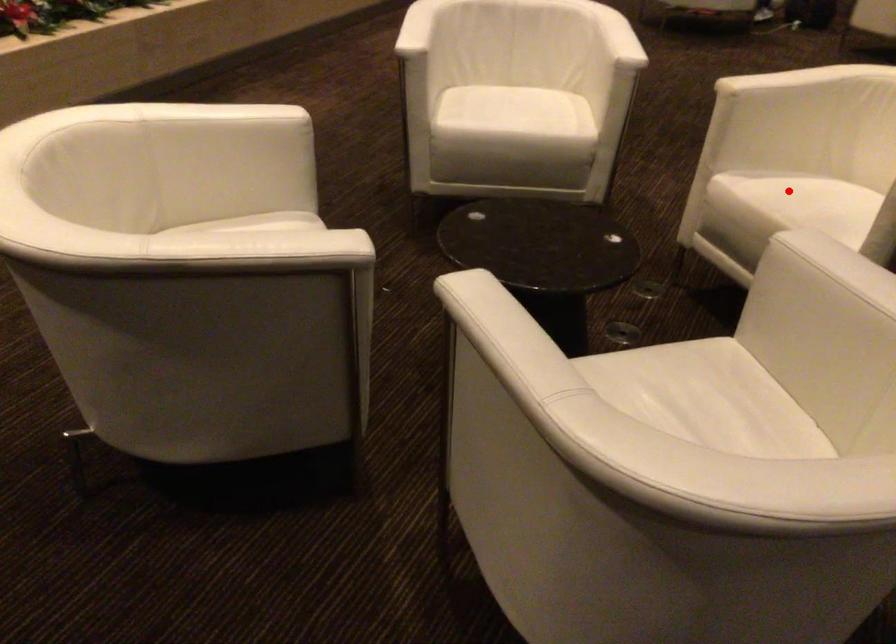
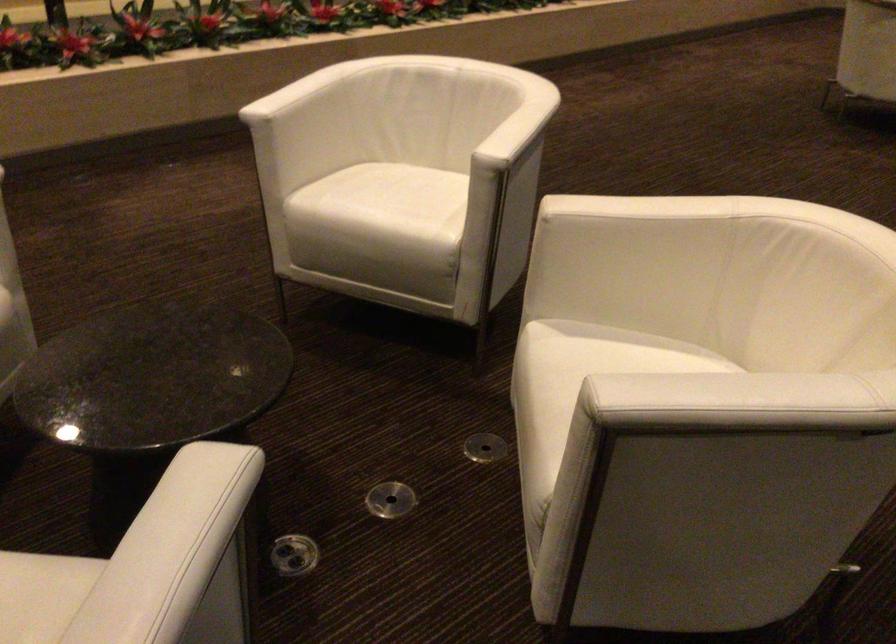
Question: I am providing you with two images of the same scene from different viewpoints. A red point is shown in image1. For the corresponding object point in image2, is it positioned nearer or farther from the camera?

Choices:
 (A) Nearer
 (B) Farther

Answer: (A)